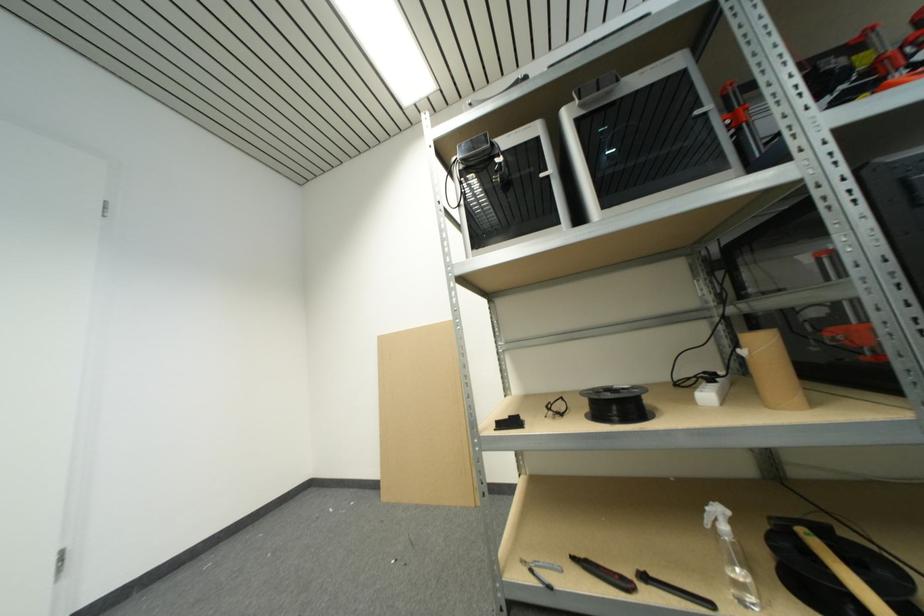
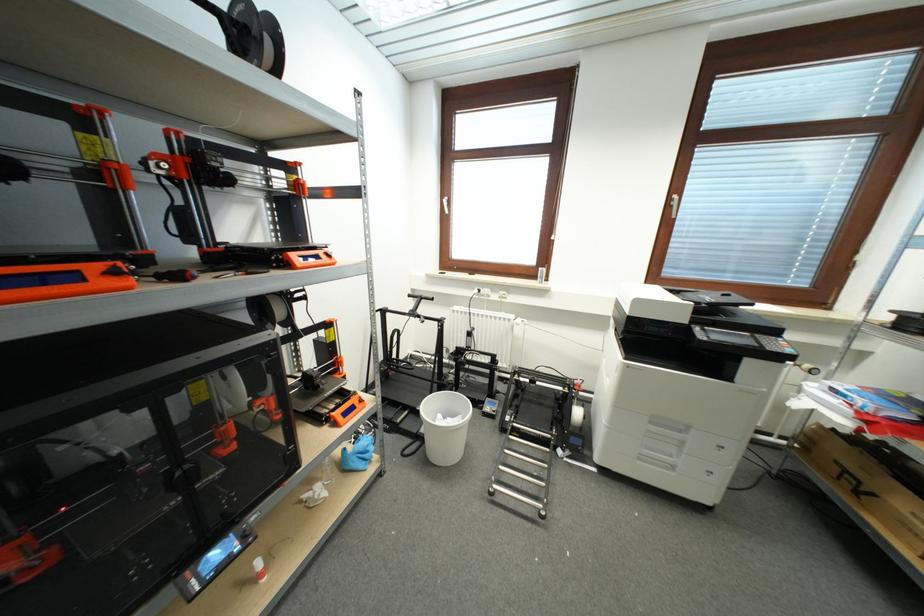
Question: The images are taken continuously from a first-person perspective. In which direction is your viewpoint rotating?

Choices:
 (A) Left
 (B) Right
 (C) Up
 (D) Down

Answer: (B)